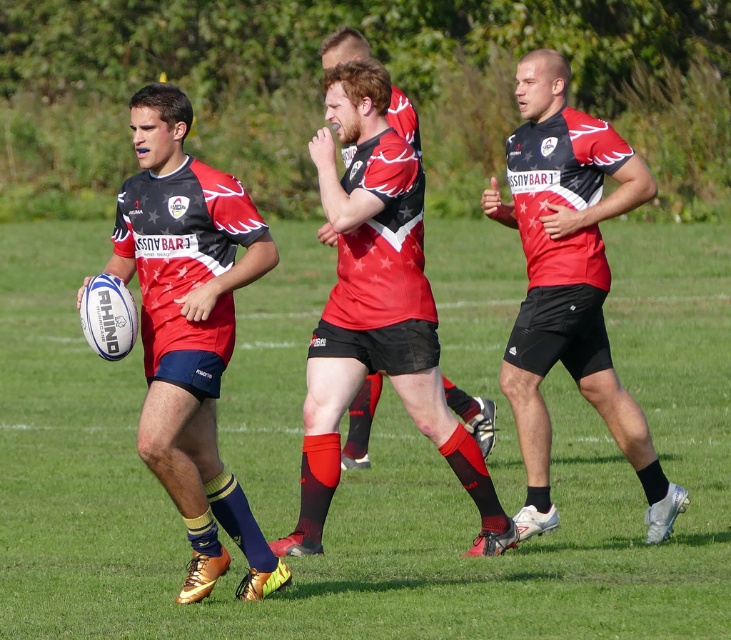
Looking at this image, who is more distant from viewer, (537,320) or (346,461)?

The point (346,461) is more distant.

Does matte black shorts at center appear over matte red jersey at center?

Yes, matte black shorts at center is above matte red jersey at center.

Does point (507, 365) come behind point (465, 413)?

No.

The width and height of the screenshot is (731, 640). Find the location of `matte black shorts at center`. matte black shorts at center is located at coordinates (568, 282).

Consider the image. Can you confirm if matte black rugby ball at left is positioned to the left of matte red jersey at center?

Correct, you'll find matte black rugby ball at left to the left of matte red jersey at center.

Is point (83, 284) closer to camera compared to point (398, 90)?

Yes, it is.

Locate an element on the screen. This screenshot has width=731, height=640. matte black rugby ball at left is located at coordinates (189, 330).

The image size is (731, 640). Find the location of `matte black rugby ball at left`. matte black rugby ball at left is located at coordinates (189, 330).

Does point (202, 595) come in front of point (586, 387)?

That is True.

Find the location of `matte black rugby ball at left`. matte black rugby ball at left is located at coordinates (189, 330).